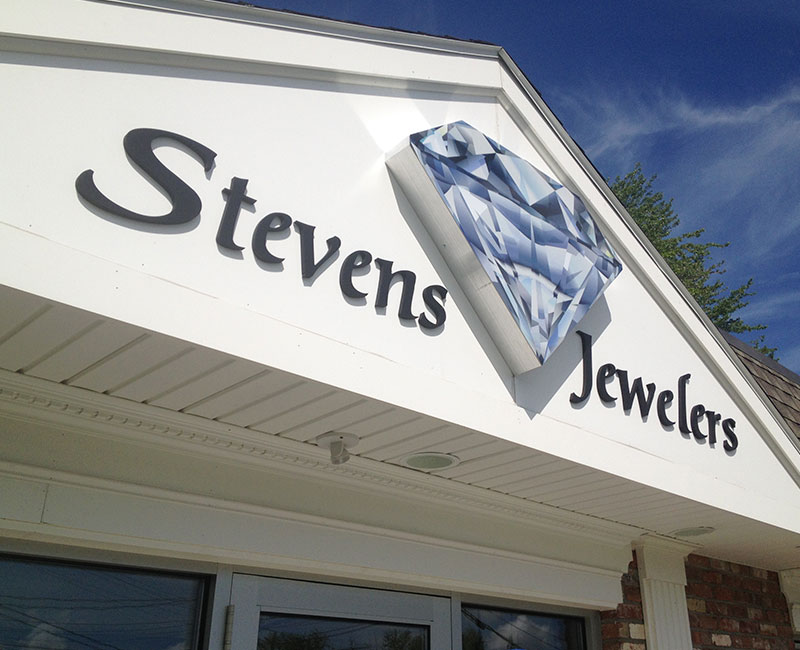
At what (x,y) coordinates should I click in order to perform the action: click on door. Please return your answer as a coordinate pair (x, y). The height and width of the screenshot is (650, 800). Looking at the image, I should click on (326, 630).